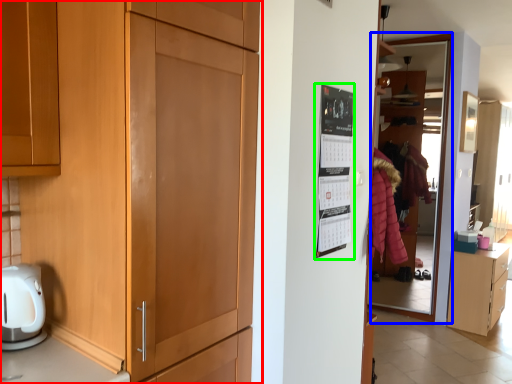
Question: Which object is the closest to the cupboard (highlighted by a red box)? Choose among these: glass door (highlighted by a blue box) or bulletin board (highlighted by a green box).

Choices:
 (A) glass door
 (B) bulletin board

Answer: (B)